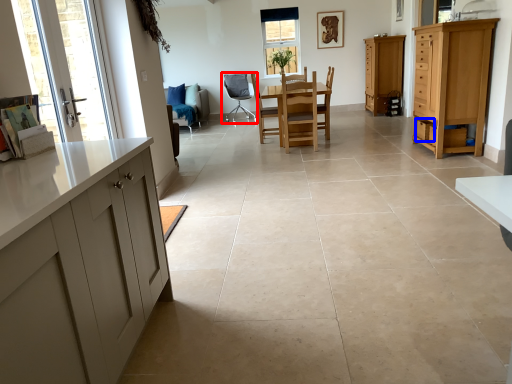
Question: Which point is further to the camera, chair (highlighted by a red box) or drawer (highlighted by a blue box)?

Choices:
 (A) chair
 (B) drawer

Answer: (A)